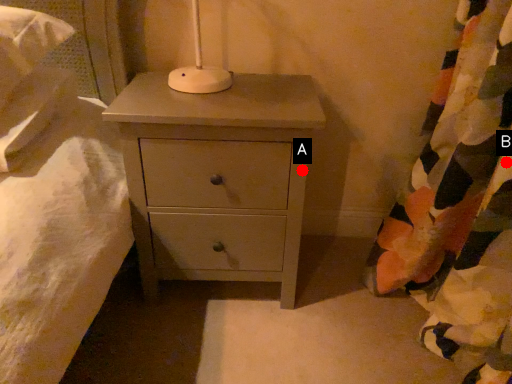
Question: Two points are circled on the image, labeled by A and B beside each circle. Which of the following is the farthest from the observer?

Choices:
 (A) A is further
 (B) B is further

Answer: (A)